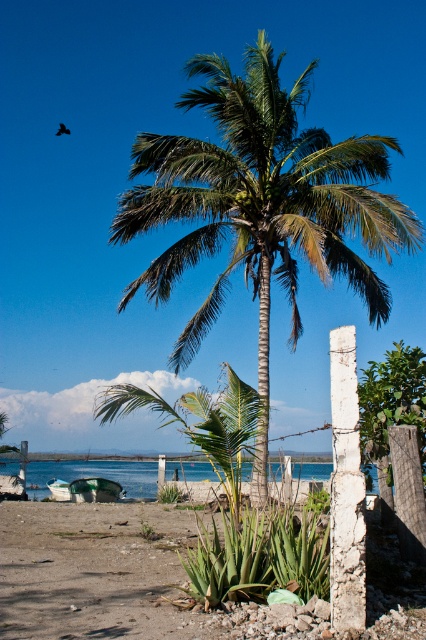
Is point (176, 465) more distant than point (111, 493)?

Yes, it is.

Is blue water at lower center above white plastic boat at lower left?

No.

The height and width of the screenshot is (640, 426). Identify the location of blue water at lower center. (94, 474).

Is brown sandy soil at lower center above white plastic boat at lower left?

Yes.

Can you confirm if brown sandy soil at lower center is bigger than white plastic boat at lower left?

Correct, brown sandy soil at lower center is larger in size than white plastic boat at lower left.

Identify the location of brown sandy soil at lower center. The height and width of the screenshot is (640, 426). (112, 577).

Where is `brown sandy soil at lower center`? This screenshot has width=426, height=640. brown sandy soil at lower center is located at coordinates (112, 577).

Is green leafy coconut tree at center positioned in front of white plastic boat at lower left?

That is True.

Which of these two, green leafy coconut tree at center or white plastic boat at lower left, stands shorter?

white plastic boat at lower left is shorter.

Which is in front, point (144, 282) or point (100, 484)?

Point (144, 282)

Locate an element on the screen. green leafy coconut tree at center is located at coordinates (261, 205).